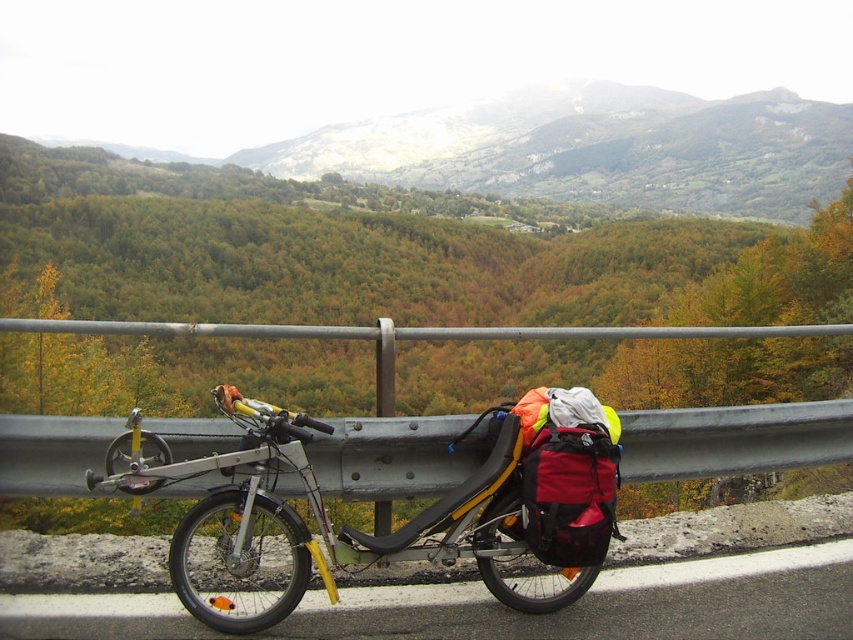
Is silver metallic bicycle at center taller than black rubber bicycle at lower center?

Indeed, silver metallic bicycle at center has a greater height compared to black rubber bicycle at lower center.

Can you confirm if silver metallic bicycle at center is positioned to the left of black rubber bicycle at lower center?

Yes, silver metallic bicycle at center is to the left of black rubber bicycle at lower center.

Describe the element at coordinates (412, 516) in the screenshot. I see `silver metallic bicycle at center` at that location.

At what (x,y) coordinates should I click in order to perform the action: click on silver metallic bicycle at center. Please return your answer as a coordinate pair (x, y). The image size is (853, 640). Looking at the image, I should click on (412, 516).

From the picture: Does metallic gray guardrail at center have a greater width compared to black rubber bicycle at lower center?

Indeed, metallic gray guardrail at center has a greater width compared to black rubber bicycle at lower center.

Who is taller, metallic gray guardrail at center or black rubber bicycle at lower center?

metallic gray guardrail at center

The image size is (853, 640). I want to click on metallic gray guardrail at center, so click(734, 440).

Based on the photo, between silver metallic bicycle at center and metallic gray guardrail at center, which one is positioned higher?

Positioned higher is silver metallic bicycle at center.

Who is shorter, silver metallic bicycle at center or metallic gray guardrail at center?

With less height is silver metallic bicycle at center.

Is point (335, 600) positioned before point (430, 428)?

Yes, it is in front of point (430, 428).

Where is `silver metallic bicycle at center`? silver metallic bicycle at center is located at coordinates (412, 516).